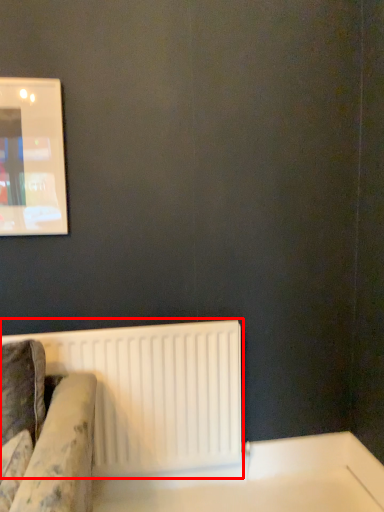
Question: From the image's perspective, where is radiator (annotated by the red box) located in relation to table in the image?

Choices:
 (A) below
 (B) above

Answer: (B)